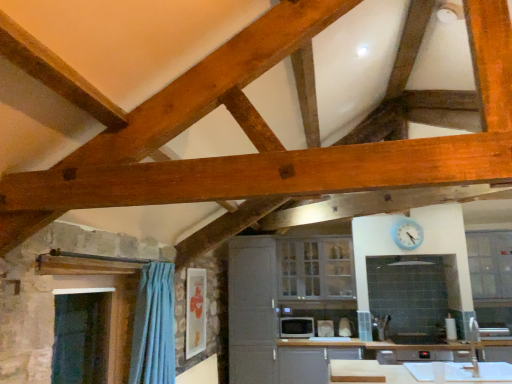
Question: Can you confirm if blue plastic clock at upper center is shorter than white glossy cabinet at center, acting as the 2th cabinetry starting from the right?

Choices:
 (A) yes
 (B) no

Answer: (A)

Question: Can you confirm if blue plastic clock at upper center is positioned to the right of white glossy cabinet at center, acting as the 2th cabinetry starting from the right?

Choices:
 (A) no
 (B) yes

Answer: (B)

Question: Is blue plastic clock at upper center outside of white glossy cabinet at center, acting as the 2th cabinetry starting from the right?

Choices:
 (A) no
 (B) yes

Answer: (B)

Question: Does blue plastic clock at upper center have a greater width compared to white glossy cabinet at center, acting as the 2th cabinetry starting from the right?

Choices:
 (A) no
 (B) yes

Answer: (A)

Question: Is blue plastic clock at upper center facing away from white glossy cabinet at center, acting as the 2th cabinetry starting from the right?

Choices:
 (A) no
 (B) yes

Answer: (A)

Question: Is blue plastic clock at upper center to the left of white glossy cabinet at center, the first cabinetry in the left-to-right sequence, from the viewer's perspective?

Choices:
 (A) no
 (B) yes

Answer: (A)

Question: Does white glossy cabinet at center, which is counted as the 2th cabinetry, starting from the left, come behind white glossy microwave at center, which ranks as the first appliance in right-to-left order?

Choices:
 (A) yes
 (B) no

Answer: (B)

Question: Is white glossy microwave at center, which ranks as the first appliance in right-to-left order, at the back of white glossy cabinet at center, positioned as the 1th cabinetry in right-to-left order?

Choices:
 (A) no
 (B) yes

Answer: (A)

Question: Can you confirm if white glossy cabinet at center, which is counted as the 2th cabinetry, starting from the left, is positioned to the left of white glossy microwave at center, which ranks as the first appliance in right-to-left order?

Choices:
 (A) no
 (B) yes

Answer: (B)

Question: From a real-world perspective, is white glossy cabinet at center, which is counted as the 2th cabinetry, starting from the left, located higher than white glossy microwave at center, which ranks as the first appliance in right-to-left order?

Choices:
 (A) no
 (B) yes

Answer: (B)

Question: Are white glossy cabinet at center, positioned as the 1th cabinetry in right-to-left order, and white glossy microwave at center, which ranks as the first appliance in right-to-left order, beside each other?

Choices:
 (A) yes
 (B) no

Answer: (B)

Question: Is white glossy cabinet at center, positioned as the 1th cabinetry in right-to-left order, wider than white glossy microwave at center, the 2th appliance from the left?

Choices:
 (A) yes
 (B) no

Answer: (A)

Question: From the image's perspective, is white glossy microwave at center, which ranks as the first appliance in right-to-left order, beneath blue plastic clock at upper center?

Choices:
 (A) no
 (B) yes

Answer: (B)